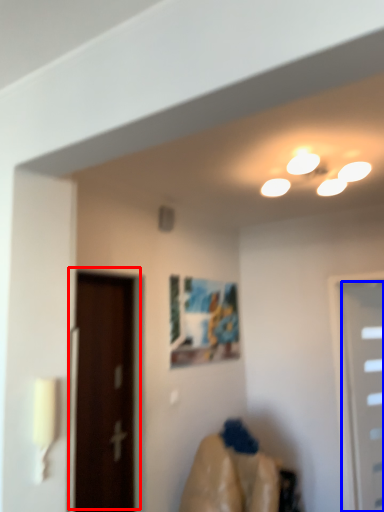
Question: Which object is closer to the camera taking this photo, door (highlighted by a red box) or door (highlighted by a blue box)?

Choices:
 (A) door
 (B) door

Answer: (A)